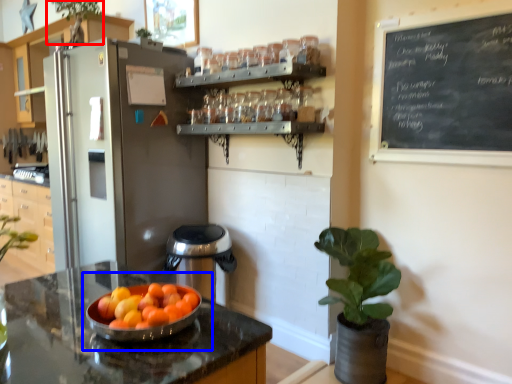
Question: Which of the following is the farthest to the observer, plant (highlighted by a red box) or fruit dish (highlighted by a blue box)?

Choices:
 (A) plant
 (B) fruit dish

Answer: (A)